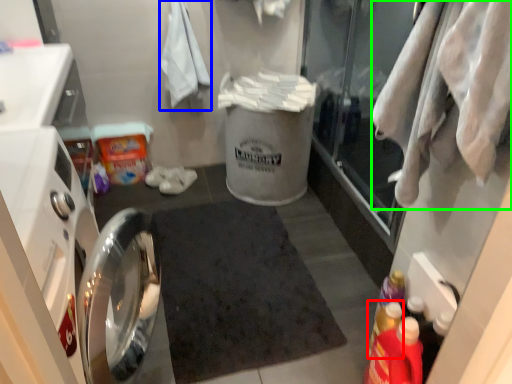
Question: Based on their relative distances, which object is nearer to bottle (highlighted by a red box)? Choose from bath towel (highlighted by a blue box) and clothing (highlighted by a green box).

Choices:
 (A) bath towel
 (B) clothing

Answer: (B)